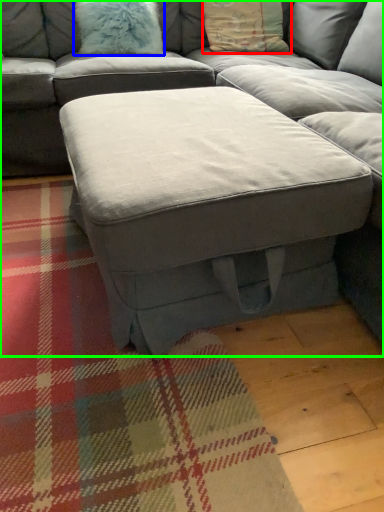
Question: Which is nearer to the pillow (highlighted by a red box)? pillow (highlighted by a blue box) or studio couch (highlighted by a green box).

Choices:
 (A) pillow
 (B) studio couch

Answer: (A)